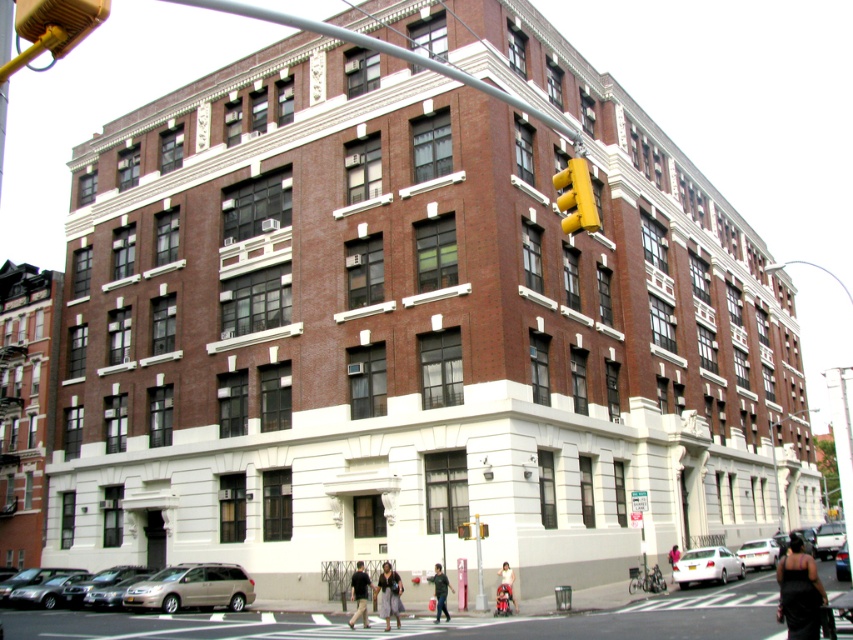
Looking at this image, you are standing at the entrance of the building and notice two vehicles parked at the lower right corner. Which vehicle is nearer to you between the white matte car at lower right and the white glossy sedan at lower right?

The white matte car at lower right is closer to you than the white glossy sedan at lower right.

You are a delivery person trying to park a 4.5 meter long van in the parking lot near the building. You see a white matte car at lower right and a white glossy sedan at lower right. Which vehicle should you avoid parking next to if you need extra space for maneuvering?

You should avoid parking next to the white glossy sedan at lower right because it is longer than the white matte car at lower right, requiring more space for maneuvering.

You are standing at the entrance of the large brick building and see the white glossy sedan at lower right. If you want to locate it precisely on a map with coordinates from 0 to 1 in both x and y axes, what are its coordinates?

The white glossy sedan at lower right is located at coordinates x 0.866 and y 0.890.